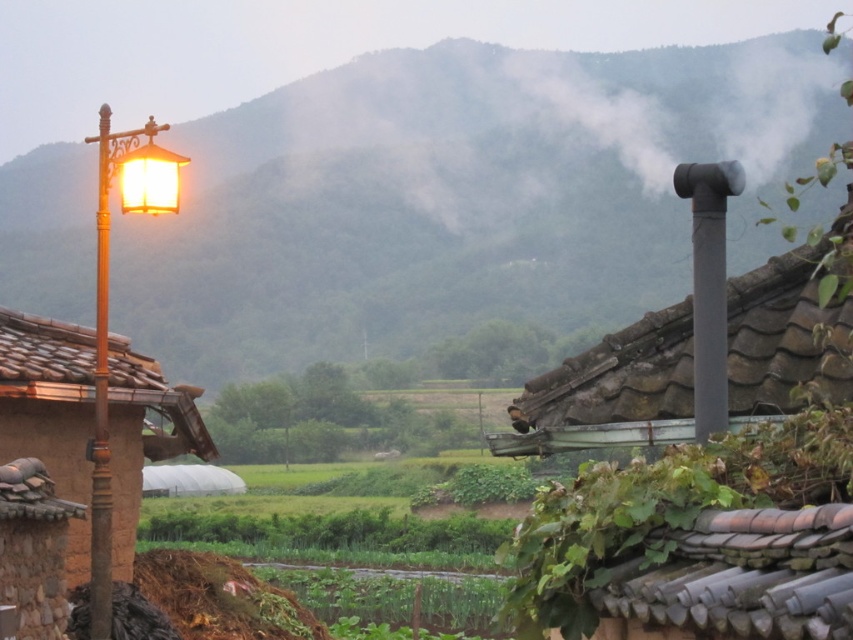
In the scene shown: You are a photographer trying to capture the green leafy hillside at upper center. According to the scene, where should you position your camera to ensure it is centered in your shot?

The green leafy hillside at upper center is located at coordinates 0.306 on the x axis and 0.533 on the y axis, so position your camera to center the shot at those coordinates.

You are an architect designing a new garden path that needs to pass between the green leafy hillside at upper center and the matte brown post at left. Which side of the path should be wider to accommodate more plants?

The green leafy hillside at upper center has a greater width than the matte brown post at left, so the path should be wider on the side of the green leafy hillside at upper center to accommodate more plants.

You are an architect designing a new garden layout and need to place a small decorative statue between the gray stone chimney at upper right and the matte brown post at left. Which object should the statue be closer to if it must be placed closer to the larger object?

The statue should be placed closer to the gray stone chimney at upper right because it is larger in size than the matte brown post at left.